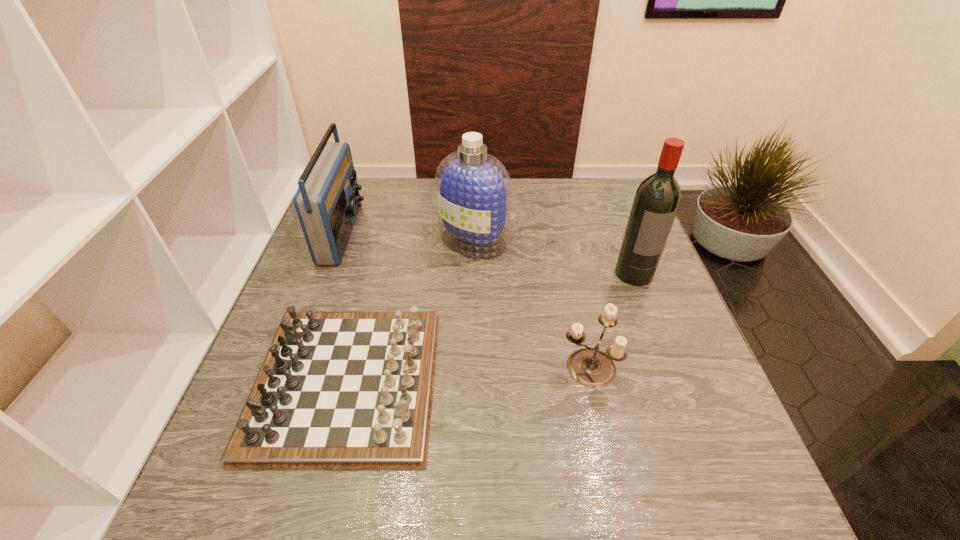
The image size is (960, 540). What are the coordinates of `vacant space at the near edge` in the screenshot? It's located at (373, 470).

This screenshot has height=540, width=960. What are the coordinates of `vacant region at the left edge` in the screenshot? It's located at (287, 307).

The height and width of the screenshot is (540, 960). In order to click on vacant space at the right edge of the desktop in this screenshot , I will do `click(680, 402)`.

The height and width of the screenshot is (540, 960). In the image, there is a desktop. In order to click on vacant space at the far left corner in this screenshot , I will do `click(360, 179)`.

Where is `vacant space in between the fourth object from left to right and the shortest object`? vacant space in between the fourth object from left to right and the shortest object is located at coordinates (467, 374).

Image resolution: width=960 pixels, height=540 pixels. I want to click on vacant area that lies between the chessboard and the rightmost object, so click(x=491, y=327).

Find the location of a particular element. The image size is (960, 540). empty space that is in between the cleansing agent and the chessboard is located at coordinates (410, 311).

At what (x,y) coordinates should I click in order to perform the action: click on vacant area between the third tallest object and the fourth shortest object. Please return your answer as a coordinate pair (x, y). Looking at the image, I should click on (408, 237).

Locate an element on the screen. Image resolution: width=960 pixels, height=540 pixels. vacant point located between the radio receiver and the cleansing agent is located at coordinates (408, 237).

In order to click on free space between the candle holder and the radio receiver in this screenshot , I will do [x=466, y=300].